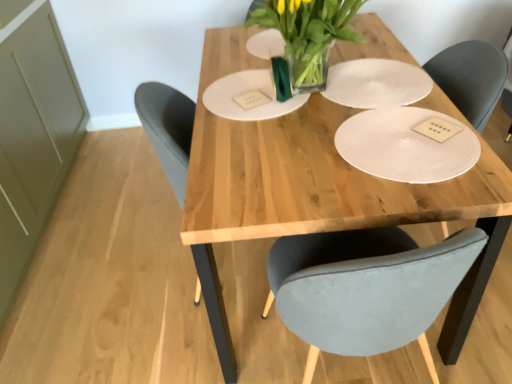
Find the location of a particular element. The width and height of the screenshot is (512, 384). vacant space that is to the left of natural wood table at center is located at coordinates (114, 268).